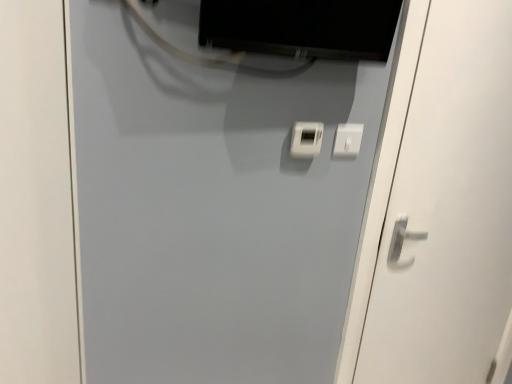
Question: Considering the positions of matte black monitor at upper center and white plastic light switch at center in the image, is matte black monitor at upper center wider or thinner than white plastic light switch at center?

Choices:
 (A) thin
 (B) wide

Answer: (B)

Question: Is matte black monitor at upper center spatially inside white plastic light switch at center, or outside of it?

Choices:
 (A) outside
 (B) inside

Answer: (A)

Question: Which object is the farthest from the matte black monitor at upper center?

Choices:
 (A) white matte door at center, placed as the first door when sorted from left to right
 (B) white plastic light switch at center
 (C) white glossy door handle at right, acting as the 1th door starting from the right

Answer: (A)

Question: Considering the real-world distances, which object is farthest from the white glossy door handle at right, which is the 2th door in left-to-right order?

Choices:
 (A) white matte door at center, placed as the first door when sorted from left to right
 (B) matte black monitor at upper center
 (C) white plastic light switch at center

Answer: (A)